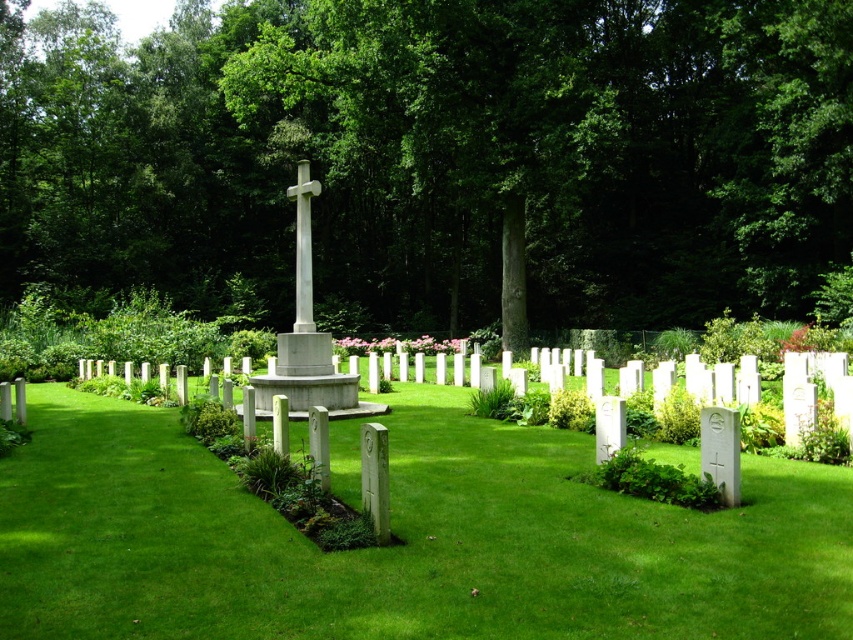
Is gray stone cross at center to the right of white marble cross at center from the viewer's perspective?

Correct, you'll find gray stone cross at center to the right of white marble cross at center.

Where is `gray stone cross at center`? Image resolution: width=853 pixels, height=640 pixels. gray stone cross at center is located at coordinates (306, 340).

Image resolution: width=853 pixels, height=640 pixels. Describe the element at coordinates (306, 340) in the screenshot. I see `gray stone cross at center` at that location.

Locate an element on the screen. gray stone cross at center is located at coordinates (306, 340).

Can you confirm if green grass at center is smaller than gray stone cross at center?

Correct, green grass at center occupies less space than gray stone cross at center.

Is point (556, 595) in front of point (279, 365)?

Yes, point (556, 595) is closer to viewer.

Describe the element at coordinates (402, 538) in the screenshot. The image size is (853, 640). I see `green grass at center` at that location.

The height and width of the screenshot is (640, 853). In order to click on green grass at center in this screenshot , I will do `click(402, 538)`.

Can you confirm if green grass at center is taller than white marble cross at center?

Incorrect, green grass at center's height is not larger of white marble cross at center's.

At what (x,y) coordinates should I click in order to perform the action: click on green grass at center. Please return your answer as a coordinate pair (x, y). This screenshot has width=853, height=640. Looking at the image, I should click on (402, 538).

Who is more distant from viewer, (44, 477) or (310, 330)?

The point (310, 330) is more distant.

In order to click on green grass at center in this screenshot , I will do `click(402, 538)`.